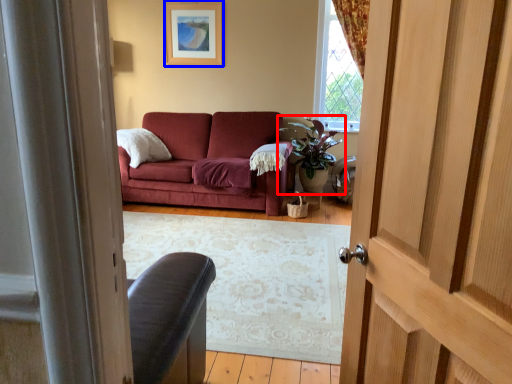
Question: Among these objects, which one is farthest to the camera, houseplant (highlighted by a red box) or picture frame (highlighted by a blue box)?

Choices:
 (A) houseplant
 (B) picture frame

Answer: (B)